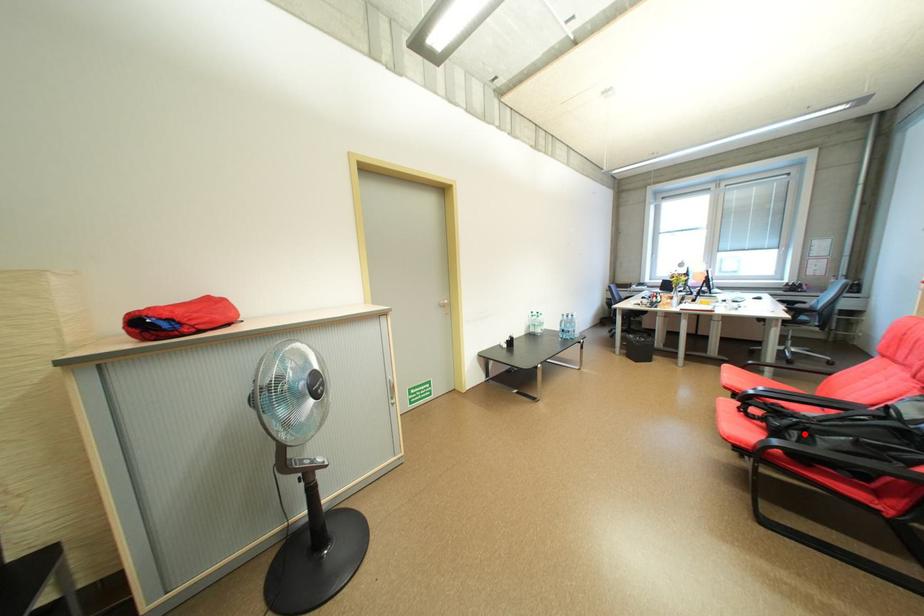
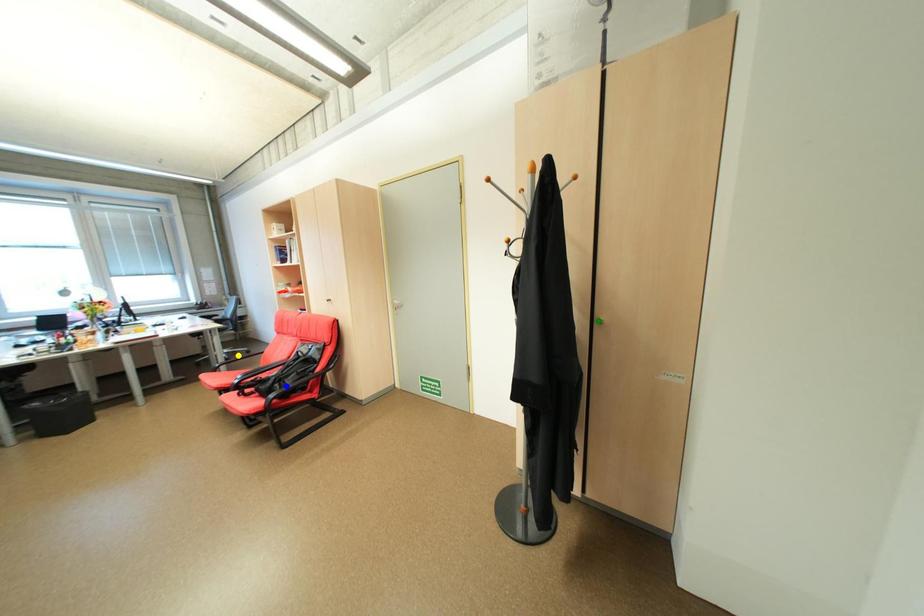
Question: I am providing you with two images of the same scene from different viewpoints. A red point is marked on the first image. You are given multiple points on the second image. Which point in image 2 is actually the same real-world point as the red point in image 1?

Choices:
 (A) yellow point
 (B) green point
 (C) blue point

Answer: (C)